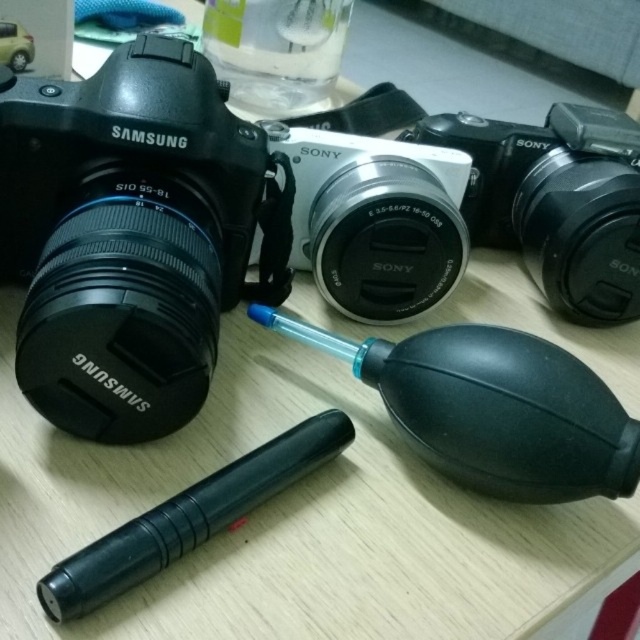
What is the color and brand of the camera located at point [193,230]?

The camera at point [193,230] is a matte black Samsung camera.

You are a photographer organizing your equipment. You need to place a new camera at point (556, 202). Is there already an object at that location?

Yes, there is a black plastic camera at center located at point (556, 202).

You are setting up a photography studio and need to place the matte black camera at left and the black rubber pen at lower left on a shelf. The shelf has a maximum weight capacity of 5 kilograms. Can you determine if both items can be placed safely on the shelf together?

The matte black camera at left is larger in size than the black rubber pen at lower left, but the question of weight capacity isn